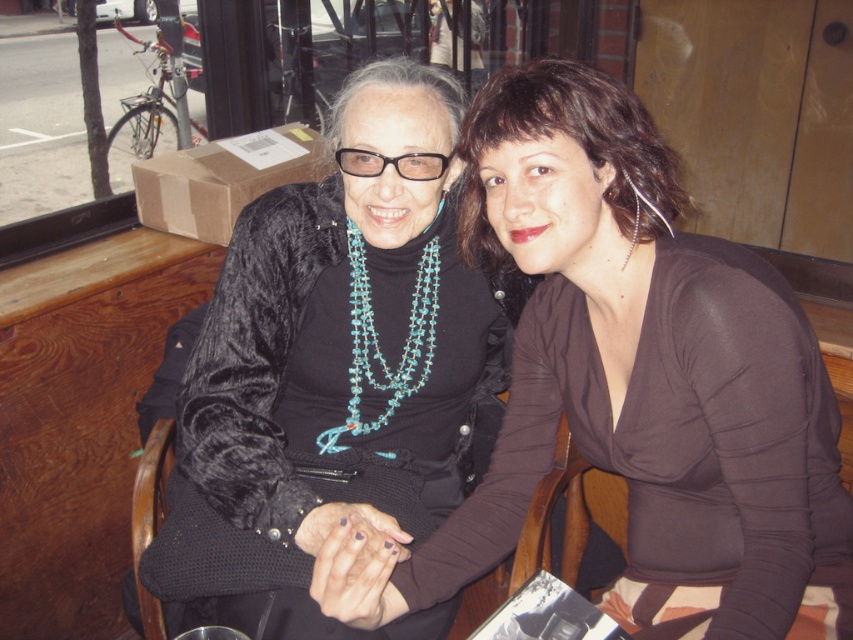
You are a tailor who needs to determine which sweater can fit into a standard 12x12 inch storage box. Based on the image, which sweater between the brown matte sweater at center and the velvet black sweater at center is more likely to fit?

The brown matte sweater at center has a smaller size compared to velvet black sweater at center, so the brown matte sweater at center is more likely to fit into the standard 12x12 inch storage box.

You are a photographer taking a portrait of the two people sitting at the table. You want to ensure that both the brown matte sweater at center and the turquoise beaded necklace at center are clearly visible in the photo. Based on their positions, which one should you focus on first to make sure it doesn t get cut off by the frame?

The turquoise beaded necklace at center should be focused on first because it is located above the brown matte sweater at center, so if the frame cuts off the top, the necklace might be excluded first.

You are an interior designer assessing the placement of the velvet black sweater at center in a room with a window and a wooden table. Based on the coordinates provided, is the sweater closer to the window or the wooden table?

The velvet black sweater at center is positioned at coordinates point (344, 349). Since the coordinates are relative to the image frame, without specific measurements to the window or table, it is impossible to determine the exact distance. However, based on typical spatial arrangements, if the sweater is centrally located, it might be equidistant to both the window and the table unless specified otherwise.